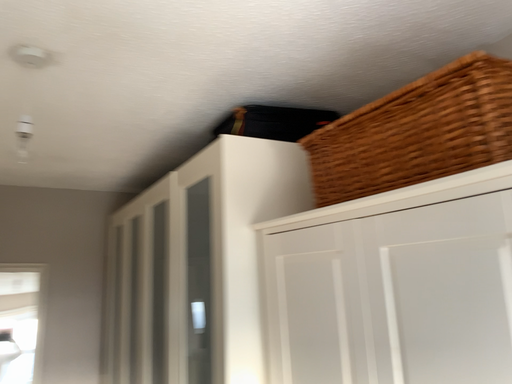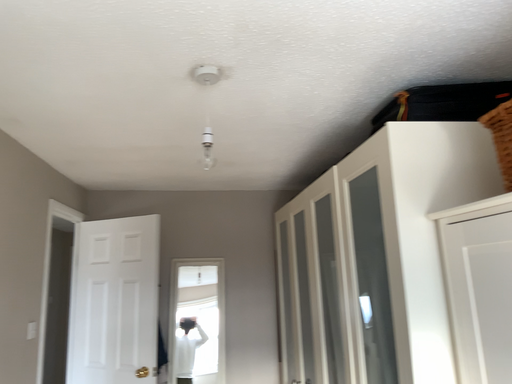
Question: Which way did the camera rotate in the video?

Choices:
 (A) rotated left
 (B) rotated right

Answer: (A)